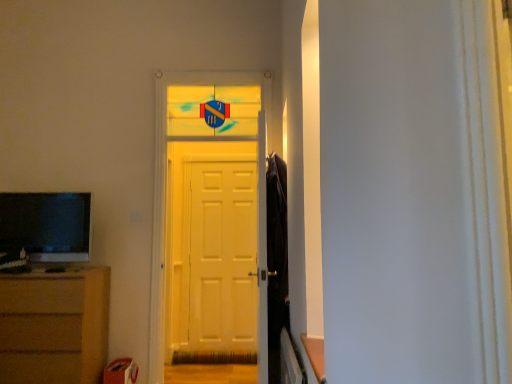
In the scene shown: What is the approximate height of matte black television at left?

It is 55.39 centimeters.

Identify the location of matte black television at left. (46, 225).

Describe the element at coordinates (222, 255) in the screenshot. I see `white matte door at center` at that location.

What do you see at coordinates (54, 326) in the screenshot? I see `brown wooden chest of drawers at lower left` at bounding box center [54, 326].

In order to click on white glossy door at center in this screenshot , I will do `click(165, 175)`.

Where is `matte black television at left`? Image resolution: width=512 pixels, height=384 pixels. matte black television at left is located at coordinates (46, 225).

Would you say matte black television at left is outside brown wooden chest of drawers at lower left?

Absolutely, matte black television at left is external to brown wooden chest of drawers at lower left.

From a real-world perspective, which object stands above the other?

In real-world perspective, matte black television at left is above.

Considering the relative positions of matte black television at left and brown wooden chest of drawers at lower left in the image provided, is matte black television at left to the left or to the right of brown wooden chest of drawers at lower left?

Based on their positions, matte black television at left is located to the right of brown wooden chest of drawers at lower left.

Relative to brown wooden chest of drawers at lower left, is matte black television at left in front or behind?

In the image, matte black television at left appears behind brown wooden chest of drawers at lower left.

Is matte black television at left inside or outside of white matte door at center?

matte black television at left is located beyond the bounds of white matte door at center.

Would you say matte black television at left is a long distance from white matte door at center?

Yes, matte black television at left and white matte door at center are quite far apart.

Considering the sizes of objects matte black television at left and white matte door at center in the image provided, who is smaller, matte black television at left or white matte door at center?

With smaller size is matte black television at left.

Is matte black television at left to the left or to the right of white matte door at center in the image?

Clearly, matte black television at left is on the left of white matte door at center in the image.

Is white glossy door at center far away from brown wooden chest of drawers at lower left?

That's not correct — white glossy door at center is a little close to brown wooden chest of drawers at lower left.

From a real-world perspective, relative to brown wooden chest of drawers at lower left, is white glossy door at center vertically above or below?

white glossy door at center is above brown wooden chest of drawers at lower left.

You are a GUI agent. You are given a task and a screenshot of the screen. Output one action in this format:
    pyautogui.click(x=<x>, y=<y>)
    Task: Click on the chest of drawers located underneath the white glossy door at center (from a real-world perspective)
    The image size is (512, 384).
    Given the screenshot: What is the action you would take?
    pyautogui.click(x=54, y=326)

Is matte black television at left at the back of brown wooden chest of drawers at lower left?

No.

From the image's perspective, between brown wooden chest of drawers at lower left and matte black television at left, who is located below?

brown wooden chest of drawers at lower left appears lower in the image.

Considering the positions of point (49, 349) and point (78, 229), is point (49, 349) closer or farther from the camera than point (78, 229)?

Point (49, 349) is positioned closer to the camera compared to point (78, 229).

How many degrees apart are the facing directions of brown wooden chest of drawers at lower left and matte black television at left?

The angle between the facing direction of brown wooden chest of drawers at lower left and the facing direction of matte black television at left is 3.94 degrees.

Considering the sizes of objects white matte door at center and white glossy door at center in the image provided, who is bigger, white matte door at center or white glossy door at center?

With larger size is white glossy door at center.

There is a white matte door at center. At what (x,y) coordinates should I click in order to perform the action: click on door above it (from a real-world perspective). Please return your answer as a coordinate pair (x, y). This screenshot has width=512, height=384. Looking at the image, I should click on (165, 175).

Would you say white matte door at center contains white glossy door at center?

Definitely not — white glossy door at center is not inside white matte door at center.

Considering the positions of objects white matte door at center and white glossy door at center in the image provided, who is behind, white matte door at center or white glossy door at center?

white matte door at center is more distant.

Which of these two, white matte door at center or brown wooden chest of drawers at lower left, is smaller?

white matte door at center is smaller.

Considering the relative sizes of white matte door at center and brown wooden chest of drawers at lower left in the image provided, is white matte door at center thinner than brown wooden chest of drawers at lower left?

Yes, white matte door at center is thinner than brown wooden chest of drawers at lower left.

Choose the correct answer: Is white matte door at center inside brown wooden chest of drawers at lower left or outside it?

The correct answer is: outside.

Is white matte door at center positioned in front of brown wooden chest of drawers at lower left?

No, white matte door at center is further to the viewer.

From a real-world perspective, which object stands above the other?

In real-world perspective, white glossy door at center is above.

Can you confirm if matte black television at left is wider than white glossy door at center?

Incorrect, the width of matte black television at left does not surpass that of white glossy door at center.

Is matte black television at left inside the boundaries of white glossy door at center, or outside?

matte black television at left is not enclosed by white glossy door at center.

Which is behind, point (86, 210) or point (173, 78)?

The point (173, 78) is farther.

Where is `chest of drawers below the matte black television at left (from a real-world perspective)`? The image size is (512, 384). chest of drawers below the matte black television at left (from a real-world perspective) is located at coordinates (54, 326).

The height and width of the screenshot is (384, 512). Find the location of `screen door below the matte black television at left (from the image's perspective)`. screen door below the matte black television at left (from the image's perspective) is located at coordinates (222, 255).

Looking at the image, which one is located closer to white matte door at center, brown wooden chest of drawers at lower left or white glossy door at center?

white glossy door at center is closer to white matte door at center.

Based on the photo, which object lies nearer to the anchor point white matte door at center, white glossy door at center or matte black television at left?

white glossy door at center lies closer to white matte door at center than the other object.

Based on their spatial positions, is white matte door at center or brown wooden chest of drawers at lower left further from white glossy door at center?

white matte door at center is further to white glossy door at center.

Looking at the image, which one is located further to matte black television at left, brown wooden chest of drawers at lower left or white glossy door at center?

white glossy door at center is positioned further to the anchor matte black television at left.

Based on the photo, considering their positions, is matte black television at left positioned closer to white glossy door at center than white matte door at center?

matte black television at left is closer to white glossy door at center.

When comparing their distances from matte black television at left, does white glossy door at center or brown wooden chest of drawers at lower left seem closer?

brown wooden chest of drawers at lower left is closer to matte black television at left.

Which object lies further to the anchor point brown wooden chest of drawers at lower left, white glossy door at center or white matte door at center?

white matte door at center is positioned further to the anchor brown wooden chest of drawers at lower left.

From the image, which object appears to be nearer to brown wooden chest of drawers at lower left, white matte door at center or matte black television at left?

matte black television at left is closer to brown wooden chest of drawers at lower left.

You are a GUI agent. You are given a task and a screenshot of the screen. Output one action in this format:
    pyautogui.click(x=<x>, y=<y>)
    Task: Click on the door positioned between matte black television at left and white matte door at center from near to far
    The image size is (512, 384).
    Given the screenshot: What is the action you would take?
    click(x=165, y=175)

At what (x,y) coordinates should I click in order to perform the action: click on television between brown wooden chest of drawers at lower left and white glossy door at center in the horizontal direction. Please return your answer as a coordinate pair (x, y). The width and height of the screenshot is (512, 384). Looking at the image, I should click on (46, 225).

The width and height of the screenshot is (512, 384). I want to click on door positioned between brown wooden chest of drawers at lower left and white matte door at center from near to far, so click(x=165, y=175).

Locate an element on the screen. This screenshot has width=512, height=384. television located between brown wooden chest of drawers at lower left and white matte door at center in the depth direction is located at coordinates (46, 225).